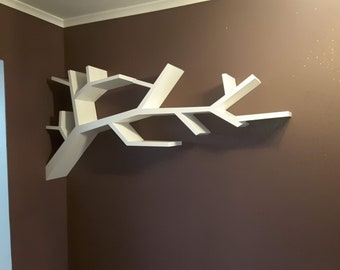
You are a GUI agent. You are given a task and a screenshot of the screen. Output one action in this format:
    pyautogui.click(x=<x>, y=<y>)
    Task: Click on the corner
    The height and width of the screenshot is (270, 340).
    Given the screenshot: What is the action you would take?
    pyautogui.click(x=67, y=216)